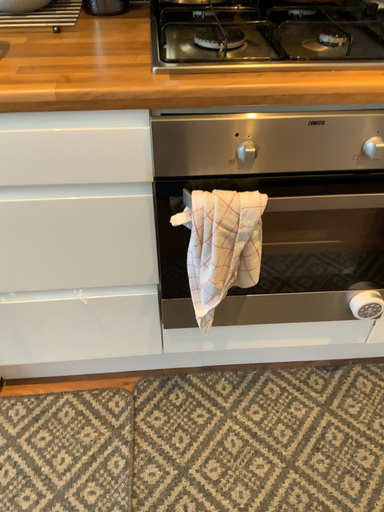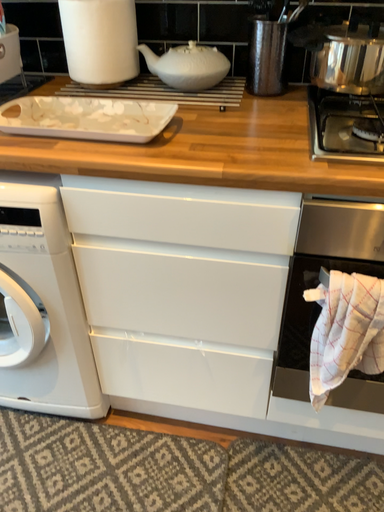
Question: Which way did the camera rotate in the video?

Choices:
 (A) rotated downward
 (B) rotated upward

Answer: (B)